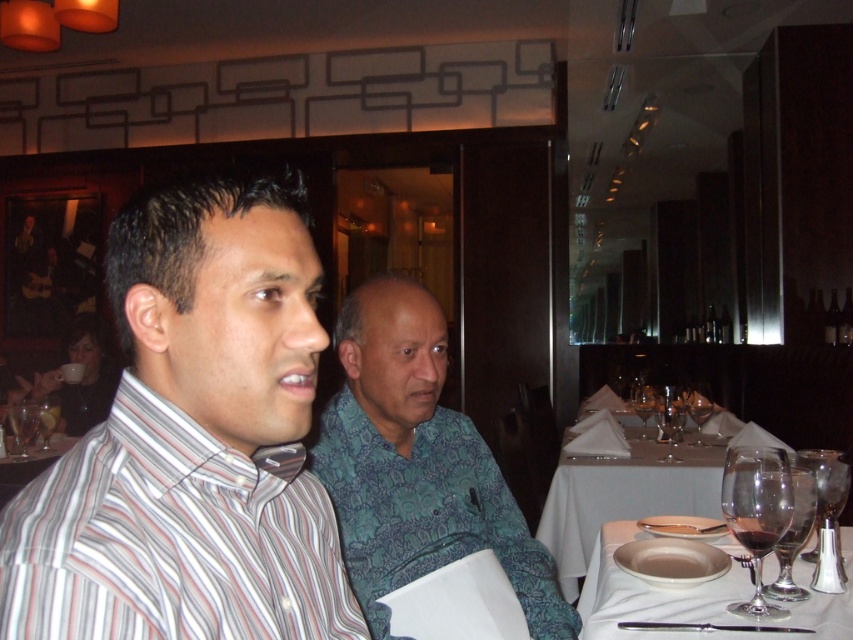
You are a photographer standing 10 feet away from the striped cotton shirt at left. You want to capture a closeup of the shirt without moving closer than 8 feet. Can you do this with a standard camera lens that has a 50mm focal length?

The striped cotton shirt at left is 19.46 inches wide. At 8 feet away, a 50mm lens on a full frame camera would have a field of view of about 48 inches. Since the shirt is only 19.46 inches wide, it would easily fit within the frame without needing to move closer.

You are standing at the entrance of the restaurant and want to find the table where the green patterned shirt at center is located. According to the coordinates provided, where should you look to find the table?

The green patterned shirt at center is located at coordinates point (416, 465), so you should look towards the lower right area of the image to find the table.

You are standing in the restaurant and want to take a photo of the striped cotton shirt at left. Where should you position your camera to capture it clearly?

To capture the striped cotton shirt at left clearly, position the camera so it faces the location at point [172,538] where the striped cotton shirt at left is located.